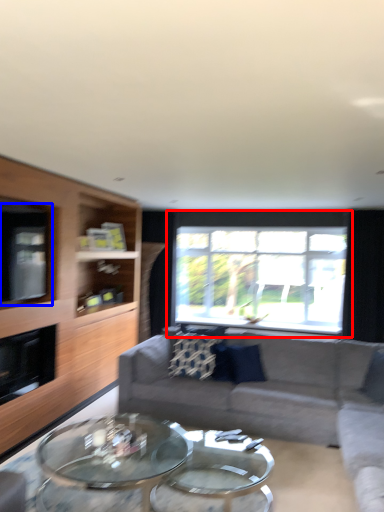
Question: Among these objects, which one is farthest to the camera, window (highlighted by a red box) or window screen (highlighted by a blue box)?

Choices:
 (A) window
 (B) window screen

Answer: (A)